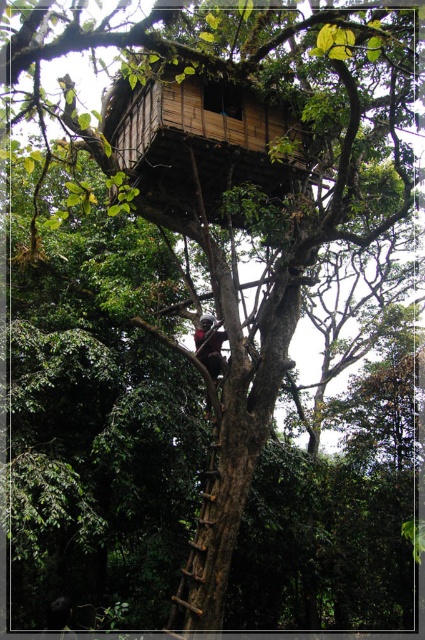
Between dark brown skin at center and dark brown leather helmet at upper center, which one is positioned higher?

Positioned higher is dark brown skin at center.

Does dark brown skin at center have a lesser height compared to dark brown leather helmet at upper center?

In fact, dark brown skin at center may be taller than dark brown leather helmet at upper center.

This screenshot has width=425, height=640. Find the location of `dark brown skin at center`. dark brown skin at center is located at coordinates (209, 346).

Can you confirm if wooden textured ladder at center is bigger than dark brown leather helmet at upper center?

Yes.

Is wooden textured ladder at center positioned at the back of dark brown leather helmet at upper center?

No, wooden textured ladder at center is closer to the viewer.

Locate an element on the screen. This screenshot has height=640, width=425. wooden textured ladder at center is located at coordinates (198, 538).

Between wooden textured ladder at center and dark brown skin at center, which one is positioned higher?

dark brown skin at center is above.

Does point (192, 582) lie behind point (207, 371)?

No, it is not.

Locate an element on the screen. Image resolution: width=425 pixels, height=640 pixels. wooden textured ladder at center is located at coordinates [198, 538].